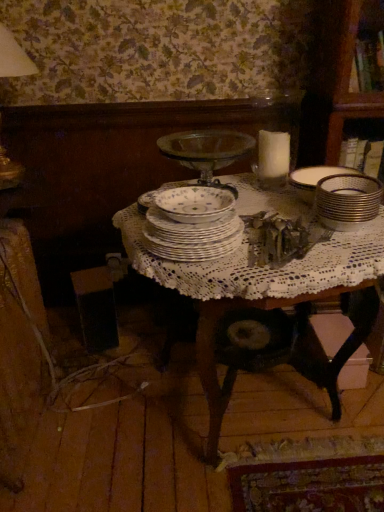
Question: Is gold metallic stack at right wider than porcelain plates at center?

Choices:
 (A) no
 (B) yes

Answer: (A)

Question: From the image's perspective, is gold metallic stack at right on porcelain plates at center?

Choices:
 (A) no
 (B) yes

Answer: (B)

Question: Would you say gold metallic stack at right is outside porcelain plates at center?

Choices:
 (A) yes
 (B) no

Answer: (A)

Question: Is gold metallic stack at right to the left of porcelain plates at center from the viewer's perspective?

Choices:
 (A) yes
 (B) no

Answer: (B)

Question: Considering the relative sizes of gold metallic stack at right and porcelain plates at center in the image provided, is gold metallic stack at right thinner than porcelain plates at center?

Choices:
 (A) no
 (B) yes

Answer: (B)

Question: Does gold metallic stack at right have a lesser height compared to porcelain plates at center?

Choices:
 (A) no
 (B) yes

Answer: (A)

Question: Can you confirm if white lace tablecloth at center is wider than porcelain plates at center?

Choices:
 (A) yes
 (B) no

Answer: (A)

Question: Can you confirm if white lace tablecloth at center is shorter than porcelain plates at center?

Choices:
 (A) no
 (B) yes

Answer: (A)

Question: Does white lace tablecloth at center appear on the right side of porcelain plates at center?

Choices:
 (A) no
 (B) yes

Answer: (B)

Question: Considering the relative sizes of white lace tablecloth at center and porcelain plates at center in the image provided, is white lace tablecloth at center thinner than porcelain plates at center?

Choices:
 (A) yes
 (B) no

Answer: (B)

Question: From the image's perspective, is white lace tablecloth at center located above porcelain plates at center?

Choices:
 (A) no
 (B) yes

Answer: (A)

Question: Can you confirm if white lace tablecloth at center is positioned to the left of porcelain plates at center?

Choices:
 (A) yes
 (B) no

Answer: (B)

Question: From the image's perspective, is porcelain plates at center on gold metallic stack at right?

Choices:
 (A) no
 (B) yes

Answer: (A)